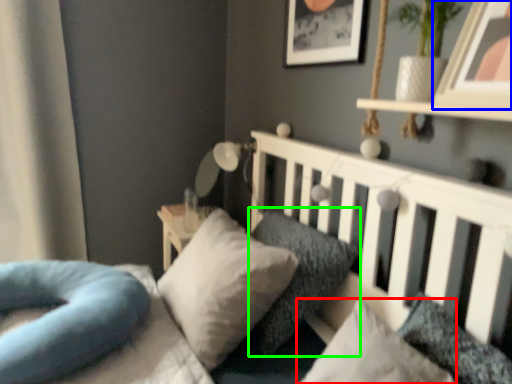
Question: Considering the real-world distances, which object is closest to pillow (highlighted by a red box)? picture frame (highlighted by a blue box) or pillow (highlighted by a green box).

Choices:
 (A) picture frame
 (B) pillow

Answer: (B)